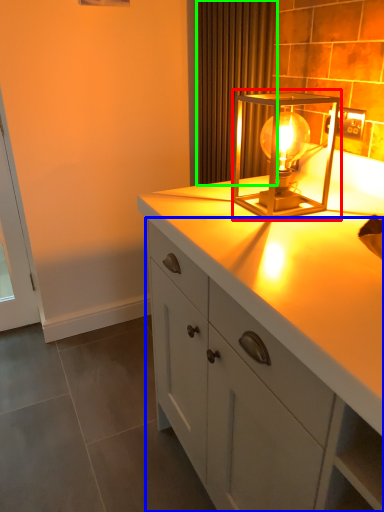
Question: Based on their relative distances, which object is farther from lamp (highlighted by a red box)? Choose from cabinetry (highlighted by a blue box) and curtain (highlighted by a green box).

Choices:
 (A) cabinetry
 (B) curtain

Answer: (A)